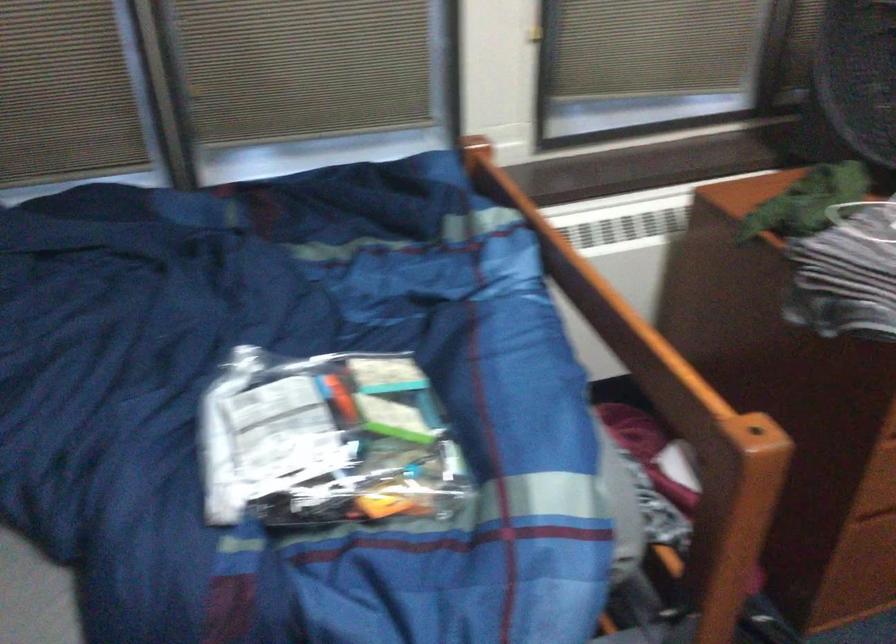
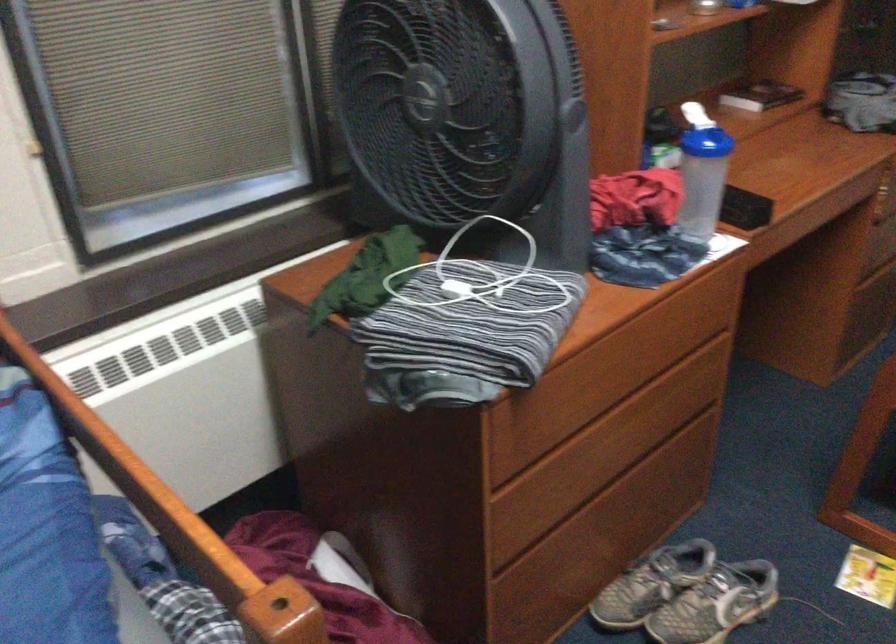
Which direction would the cameraman need to move to produce the second image?

The cameraman moved toward right, forward.